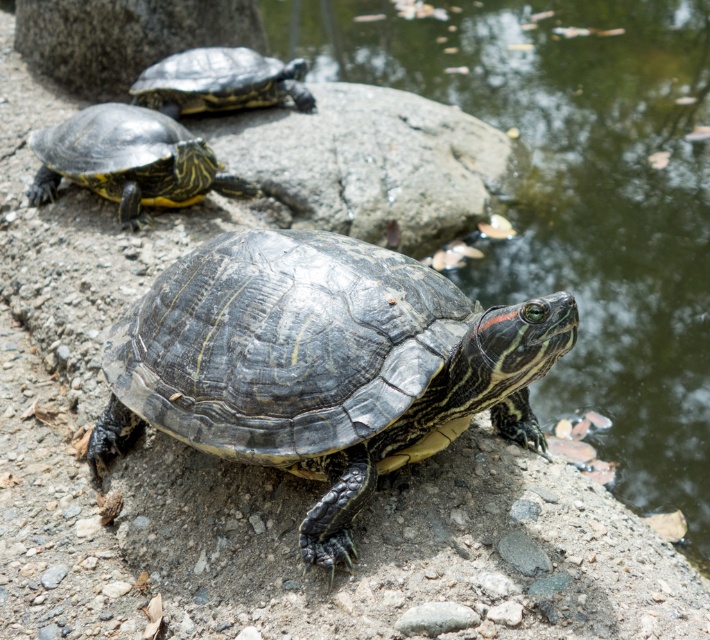
You are standing in the scene and want to reach both the turtle at point (518, 241) and the turtle at point (226, 342). Which turtle will you encounter first as you move forward?

You will encounter the turtle at point (518, 241) first because it is closer to you than the turtle at point (226, 342).

You are a small frog trying to jump from the shiny black turtle at upper center to the glossy water at center. Based on the scene, can you safely make this jump?

The glossy water at center is wider than the shiny black turtle at upper center, so the frog can safely jump from the shiny black turtle at upper center to the glossy water at center.